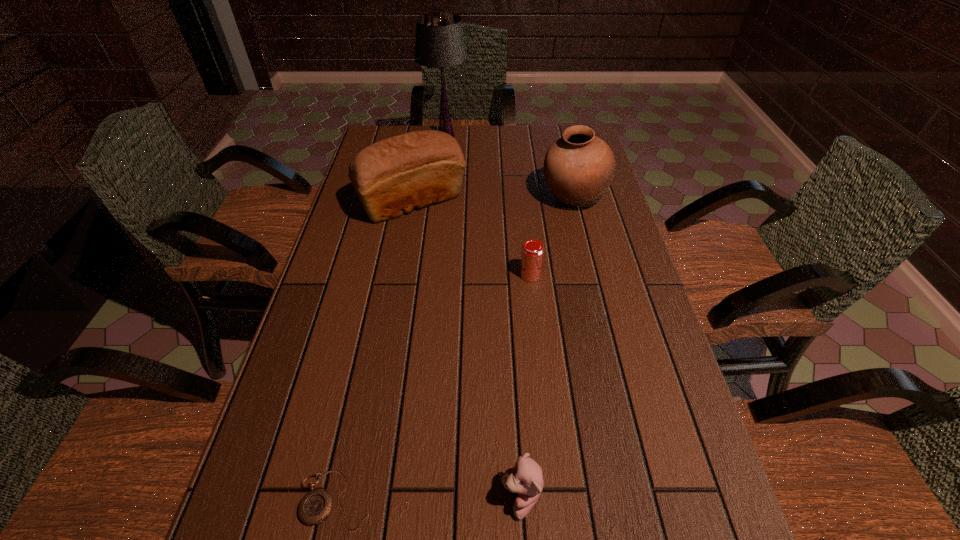
In the image, there is a desktop. What are the coordinates of `vacant space at the right edge` in the screenshot? It's located at (680, 532).

Identify the location of free area in between the lampshade and the teddy bear. (484, 318).

You are a GUI agent. You are given a task and a screenshot of the screen. Output one action in this format:
    pyautogui.click(x=<x>, y=<y>)
    Task: Click on the vacant region between the tallest object and the teddy bear
    This screenshot has height=540, width=960.
    Given the screenshot: What is the action you would take?
    pyautogui.click(x=484, y=318)

This screenshot has height=540, width=960. In order to click on vacant area that lies between the bread and the pottery in this screenshot , I will do `click(493, 199)`.

The width and height of the screenshot is (960, 540). Find the location of `free space between the lampshade and the pocket watch`. free space between the lampshade and the pocket watch is located at coordinates (391, 318).

Find the location of a particular element. vacant point located between the shortest object and the tallest object is located at coordinates (391, 318).

In order to click on vacant region between the teddy bear and the pocket watch in this screenshot , I will do `click(428, 499)`.

Locate an element on the screen. free space that is in between the bread and the rightmost object is located at coordinates (493, 199).

Where is `vacant area that lies between the teddy bear and the rightmost object`? The image size is (960, 540). vacant area that lies between the teddy bear and the rightmost object is located at coordinates pyautogui.click(x=548, y=348).

Select which object appears as the closest to the teddy bear. Please provide its 2D coordinates. Your answer should be formatted as a tuple, i.e. [(x, y)], where the tuple contains the x and y coordinates of a point satisfying the conditions above.

[(315, 507)]